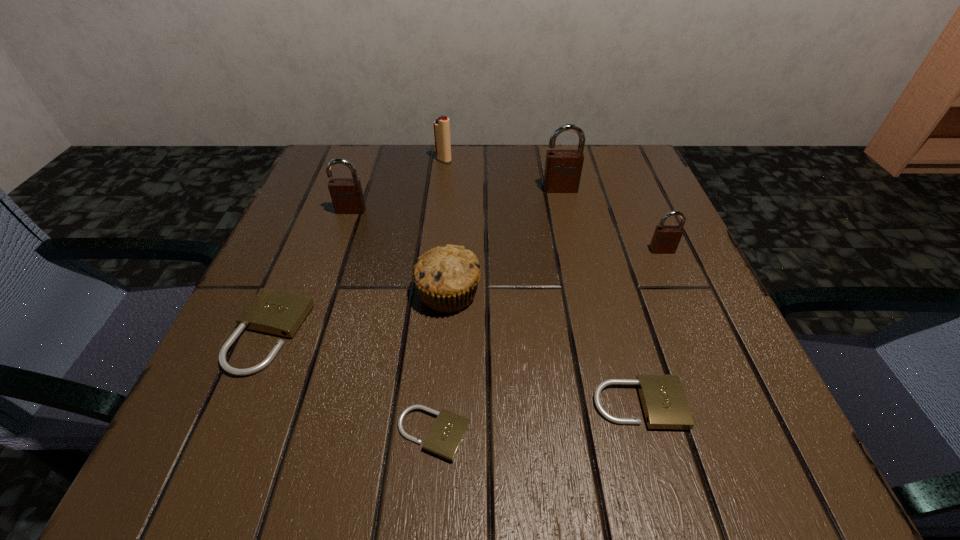
The image size is (960, 540). Identify the location of free region located on the back of the biggest beige padlock. [327, 197].

Locate an element on the screen. This screenshot has height=540, width=960. free region located on the back of the second shortest padlock is located at coordinates (587, 217).

The image size is (960, 540). What are the coordinates of `free space located 0.360m on the right of the shortest padlock` in the screenshot? It's located at (750, 434).

Identify the location of padlock at the far edge. This screenshot has width=960, height=540. (563, 168).

At what (x,y) coordinates should I click in order to perform the action: click on igniter at the far edge. Please return your answer as a coordinate pair (x, y). Looking at the image, I should click on (442, 125).

Locate an element on the screen. The width and height of the screenshot is (960, 540). object located at the near right corner is located at coordinates (663, 400).

Identify the location of vacant space at the far edge. (449, 164).

The image size is (960, 540). In the image, there is a desktop. In order to click on vacant space at the near edge in this screenshot , I will do `click(585, 431)`.

In the image, there is a desktop. In order to click on vacant space at the left edge in this screenshot , I will do `click(355, 217)`.

The image size is (960, 540). Find the location of `vacant space at the right edge of the desktop`. vacant space at the right edge of the desktop is located at coordinates (709, 362).